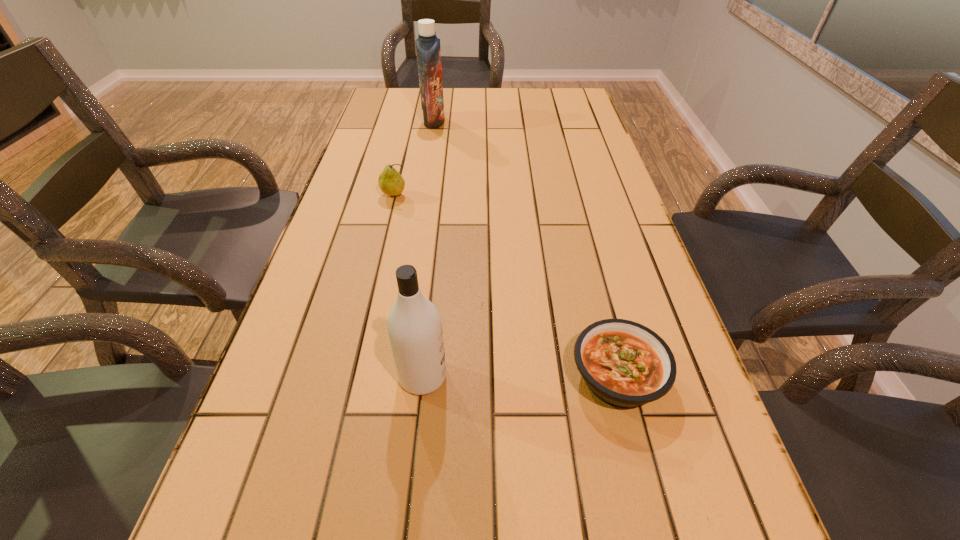
The image size is (960, 540). I want to click on the farther shampoo, so click(x=428, y=49).

Locate an element on the screen. This screenshot has width=960, height=540. the nearer shampoo is located at coordinates (414, 325).

Image resolution: width=960 pixels, height=540 pixels. Identify the location of the second tallest object. (414, 325).

Find the location of a particular element. The image size is (960, 540). pear is located at coordinates (390, 181).

Find the location of a particular element. the third tallest object is located at coordinates (390, 181).

Locate an element on the screen. the shortest object is located at coordinates click(x=625, y=364).

At what (x,y) coordinates should I click in order to perform the action: click on the rightmost object. Please return your answer as a coordinate pair (x, y). This screenshot has width=960, height=540. Looking at the image, I should click on (625, 364).

Locate an element on the screen. vacant region located 0.240m on the front label of the farther shampoo is located at coordinates (515, 122).

Identify the location of free space located 0.070m on the front-facing side of the shorter shampoo. The height and width of the screenshot is (540, 960). (485, 376).

Where is `vacant space located on the front of the leftmost object`? vacant space located on the front of the leftmost object is located at coordinates (381, 251).